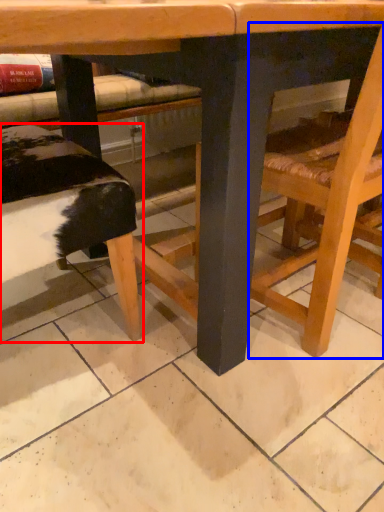
Question: Which object appears closest to the camera in this image, park bench (highlighted by a red box) or chair (highlighted by a blue box)?

Choices:
 (A) park bench
 (B) chair

Answer: (B)